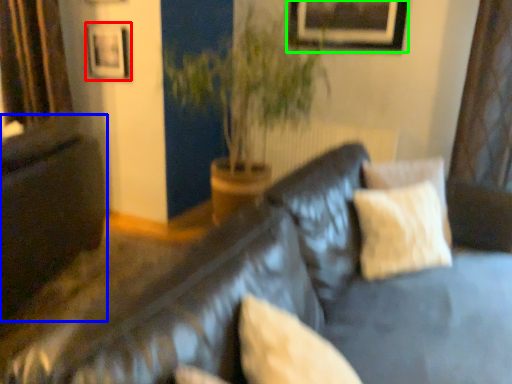
Question: Estimate the real-world distances between objects in this image. Which object is closer to picture frame (highlighted by a red box), dark (highlighted by a blue box) or picture frame (highlighted by a green box)?

Choices:
 (A) dark
 (B) picture frame

Answer: (A)